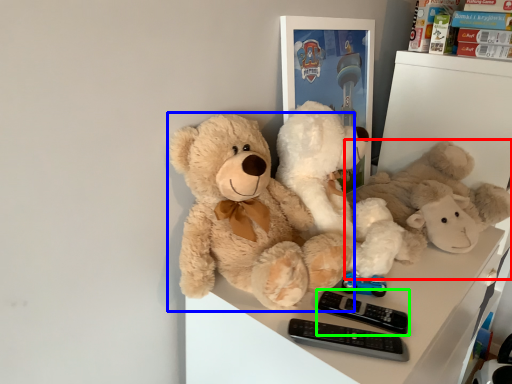
Question: Estimate the real-world distances between objects in this image. Which object is closer to teddy bear (highlighted by a red box), teddy bear (highlighted by a blue box) or control (highlighted by a green box)?

Choices:
 (A) teddy bear
 (B) control

Answer: (A)